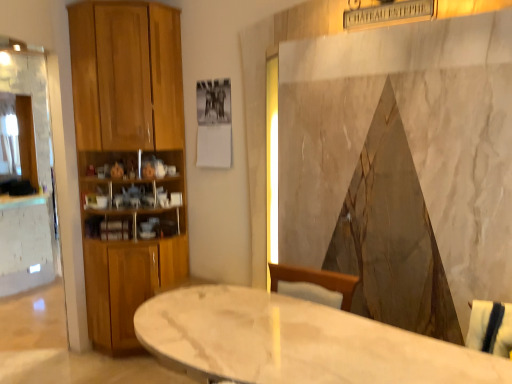
This screenshot has width=512, height=384. I want to click on wooden cabinet at left, so click(x=128, y=159).

Describe the element at coordinates (128, 159) in the screenshot. I see `wooden cabinet at left` at that location.

Measure the distance between white marble table at center and camera.

The distance of white marble table at center from camera is 4.15 feet.

The height and width of the screenshot is (384, 512). Find the location of `white marble table at center`. white marble table at center is located at coordinates (297, 342).

Image resolution: width=512 pixels, height=384 pixels. What do you see at coordinates (297, 342) in the screenshot?
I see `white marble table at center` at bounding box center [297, 342].

The image size is (512, 384). What are the coordinates of `wooden cabinet at left` in the screenshot? It's located at (128, 159).

Based on the photo, which object is positioned more to the left, white marble table at center or wooden cabinet at left?

Positioned to the left is wooden cabinet at left.

Is white marble table at center behind wooden cabinet at left?

No, it is in front of wooden cabinet at left.

Which is closer, (x=191, y=303) or (x=168, y=99)?

The point (x=191, y=303) is in front.

From the image's perspective, which object appears higher, white marble table at center or wooden cabinet at left?

wooden cabinet at left, from the image's perspective.

From a real-world perspective, is white marble table at center positioned over wooden cabinet at left based on gravity?

Incorrect, from a real-world perspective, white marble table at center is lower than wooden cabinet at left.

Considering the relative sizes of white marble table at center and wooden cabinet at left in the image provided, is white marble table at center thinner than wooden cabinet at left?

No.

Between white marble table at center and wooden cabinet at left, which one has less height?

With less height is white marble table at center.

Is white marble table at center smaller than wooden cabinet at left?

Correct, white marble table at center occupies less space than wooden cabinet at left.

Is wooden cabinet at left located within white marble table at center?

Definitely not — wooden cabinet at left is not inside white marble table at center.

Is white marble table at center with wooden cabinet at left?

white marble table at center is not next to wooden cabinet at left, and they're not touching.

Is wooden cabinet at left at the back of white marble table at center?

No, wooden cabinet at left is not at the back of white marble table at center.

How many degrees apart are the facing directions of white marble table at center and wooden cabinet at left?

The angular difference between white marble table at center and wooden cabinet at left is 85.7 degrees.

At what (x,y) coordinates should I click in order to perform the action: click on closet behind the white marble table at center. Please return your answer as a coordinate pair (x, y). The width and height of the screenshot is (512, 384). Looking at the image, I should click on (128, 159).

Does wooden cabinet at left appear on the right side of white marble table at center?

In fact, wooden cabinet at left is to the left of white marble table at center.

In the scene shown: Which object is closer to the camera, wooden cabinet at left or white marble table at center?

white marble table at center is in front.

Does point (100, 269) come in front of point (250, 347)?

No, (100, 269) is behind (250, 347).

From the image's perspective, which is above, wooden cabinet at left or white marble table at center?

wooden cabinet at left.

From a real-world perspective, is wooden cabinet at left physically below white marble table at center?

No.

Is wooden cabinet at left thinner than white marble table at center?

Yes.

Can you confirm if wooden cabinet at left is shorter than white marble table at center?

No.

Considering the sizes of objects wooden cabinet at left and white marble table at center in the image provided, who is bigger, wooden cabinet at left or white marble table at center?

wooden cabinet at left.

From the picture: Is wooden cabinet at left positioned beyond the bounds of white marble table at center?

Yes, wooden cabinet at left is not within white marble table at center.

Is wooden cabinet at left far from white marble table at center?

Yes, wooden cabinet at left and white marble table at center are quite far apart.

In the scene shown: Is wooden cabinet at left looking in the opposite direction of white marble table at center?

wooden cabinet at left is not turned away from white marble table at center.

Can you tell me how much wooden cabinet at left and white marble table at center differ in facing direction?

The facing directions of wooden cabinet at left and white marble table at center are 85.7 degrees apart.

How distant is wooden cabinet at left from white marble table at center?

wooden cabinet at left is 1.52 meters from white marble table at center.

I want to click on closet behind the white marble table at center, so click(x=128, y=159).

Locate an element on the screen. The width and height of the screenshot is (512, 384). closet positioned vertically above the white marble table at center (from a real-world perspective) is located at coordinates (128, 159).

Identify the location of table directly beneath the wooden cabinet at left (from a real-world perspective). Image resolution: width=512 pixels, height=384 pixels. (297, 342).